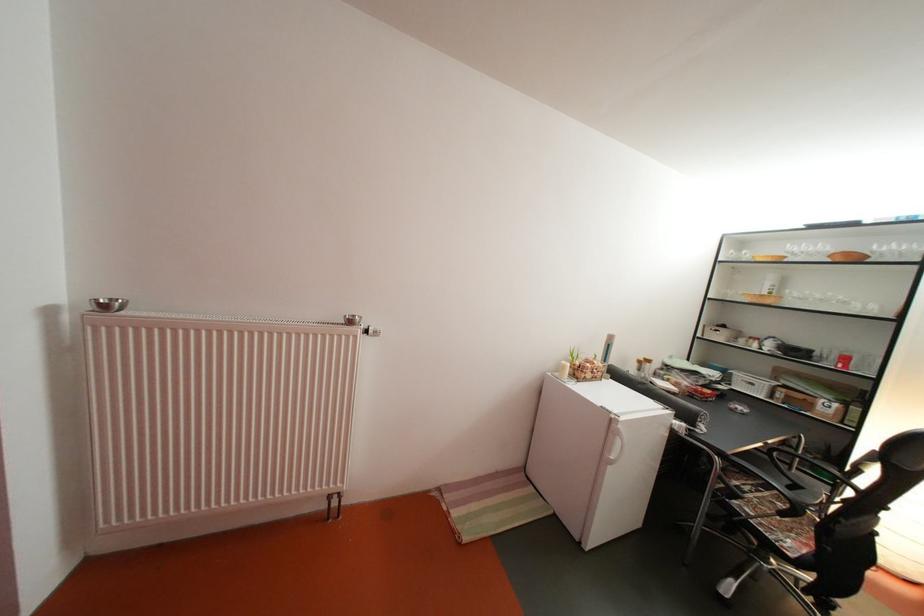
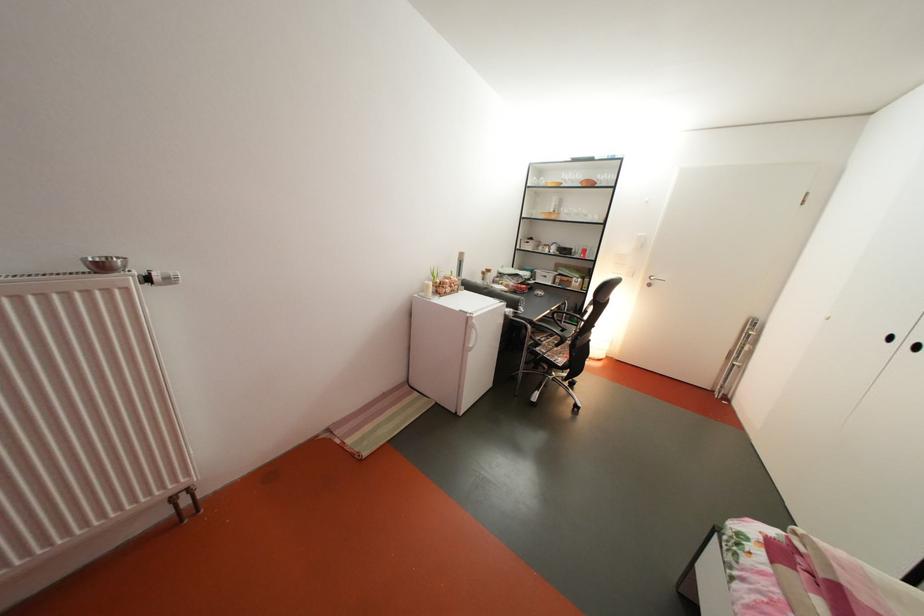
Locate, in the second image, the point that corresponds to (845,363) in the first image.

(591, 257)